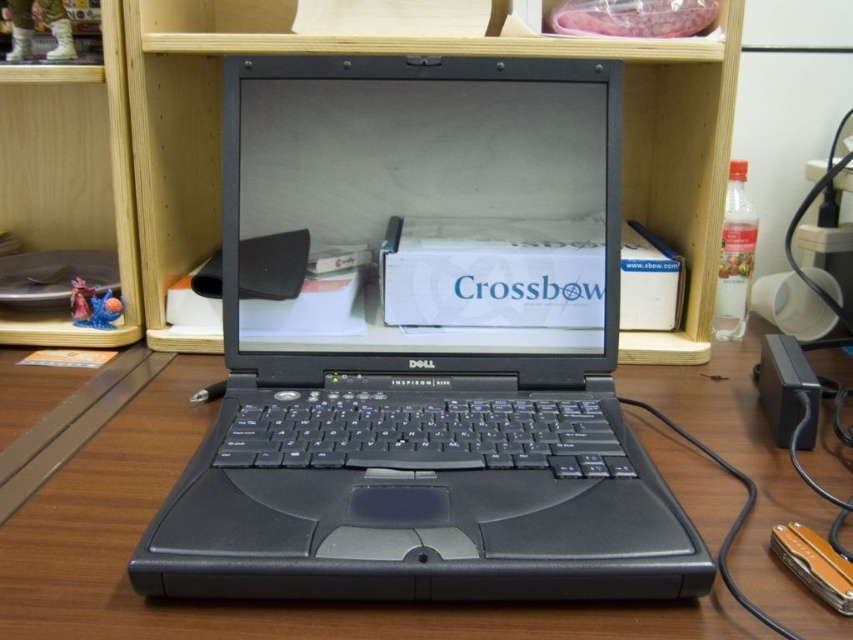
Question: Which of these objects is positioned closest to the wooden bookshelf at center?

Choices:
 (A) black rubber mouse at center
 (B) black plastic laptop at center
 (C) wooden bookshelf at upper left

Answer: (C)

Question: Which point is closer to the camera?

Choices:
 (A) (619, 477)
 (B) (378, 550)

Answer: (B)

Question: Does wooden bookshelf at center appear under wooden bookshelf at upper left?

Choices:
 (A) yes
 (B) no

Answer: (B)

Question: Can you confirm if black plastic laptop at center is positioned above wooden table at center?

Choices:
 (A) yes
 (B) no

Answer: (A)

Question: Is black plastic laptop at center to the right of wooden bookshelf at upper left from the viewer's perspective?

Choices:
 (A) yes
 (B) no

Answer: (A)

Question: Among these points, which one is nearest to the camera?

Choices:
 (A) (97, 200)
 (B) (738, 460)

Answer: (B)